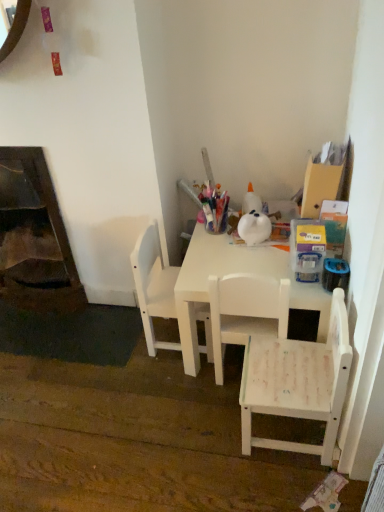
Where is `vacant area situated below white matte chair at center, acting as the 3th chair starting from the right (from a real-world perspective)`? vacant area situated below white matte chair at center, acting as the 3th chair starting from the right (from a real-world perspective) is located at coordinates coord(165,334).